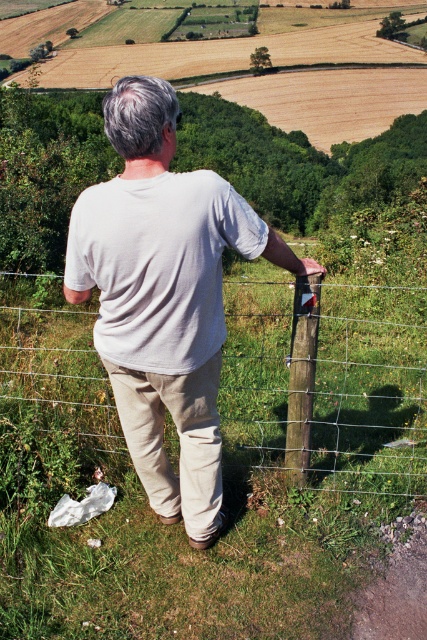
You are a photographer trying to capture a shot of the white cotton shirt at center without the wire mesh fence at center blocking the view. Is this possible given their positions?

The white cotton shirt at center is behind the wire mesh fence at center, so it is blocked by the fence and cannot be seen clearly without moving closer or adjusting the angle.

You are standing at the point marked as point (35, 406) in the image. You want to walk straight towards the person leaning against the wooden post of the wire fence. How far will you have to walk to reach them?

The distance between you and the viewer is 4.64 meters, so you will have to walk 4.64 meters to reach the person leaning against the wooden post of the wire fence.